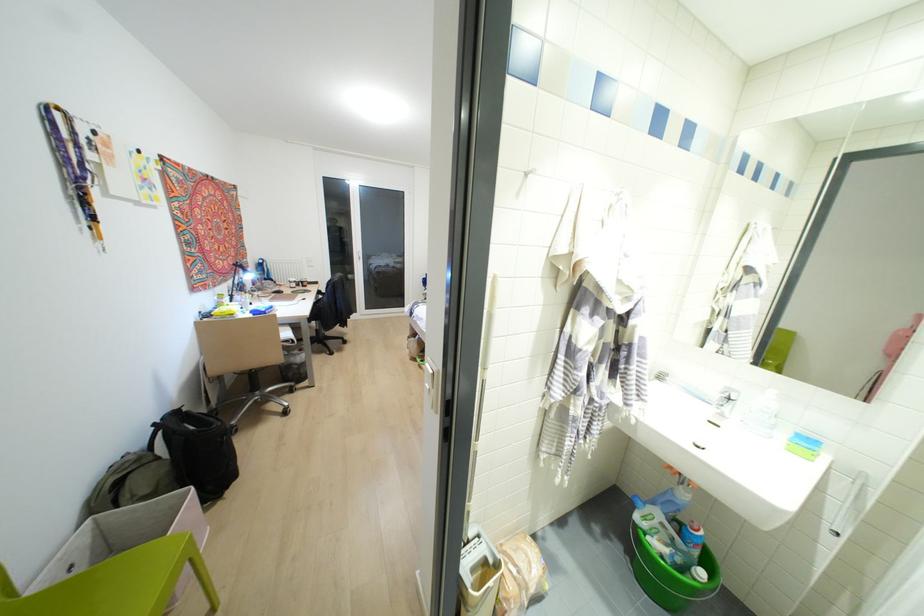
I want to click on soap dispenser pump, so click(x=804, y=447).